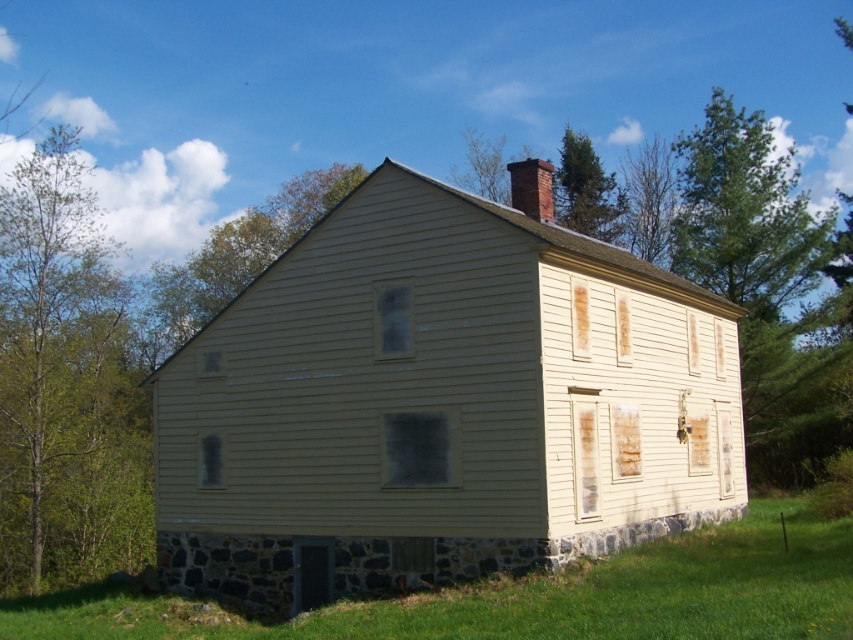
Is the position of green leafy tree at left more distant than that of green leafy tree at upper center?

That is False.

Looking at this image, is green leafy tree at left smaller than green leafy tree at upper center?

No, green leafy tree at left is not smaller than green leafy tree at upper center.

What do you see at coordinates (65, 381) in the screenshot? The width and height of the screenshot is (853, 640). I see `green leafy tree at left` at bounding box center [65, 381].

The width and height of the screenshot is (853, 640). Find the location of `green leafy tree at left`. green leafy tree at left is located at coordinates (65, 381).

Does green coniferous tree at upper right have a greater height compared to green coniferous tree at upper center?

Correct, green coniferous tree at upper right is much taller as green coniferous tree at upper center.

Is point (714, 221) positioned after point (581, 170)?

No.

Which is behind, point (810, 268) or point (618, 225)?

Point (618, 225)

I want to click on green coniferous tree at upper right, so click(744, 212).

Which is behind, point (57, 292) or point (798, 252)?

Positioned behind is point (57, 292).

Does green leafy tree at left appear under green coniferous tree at upper right?

Yes, green leafy tree at left is below green coniferous tree at upper right.

What do you see at coordinates (65, 381) in the screenshot? I see `green leafy tree at left` at bounding box center [65, 381].

Locate an element on the screen. The height and width of the screenshot is (640, 853). green leafy tree at left is located at coordinates (65, 381).